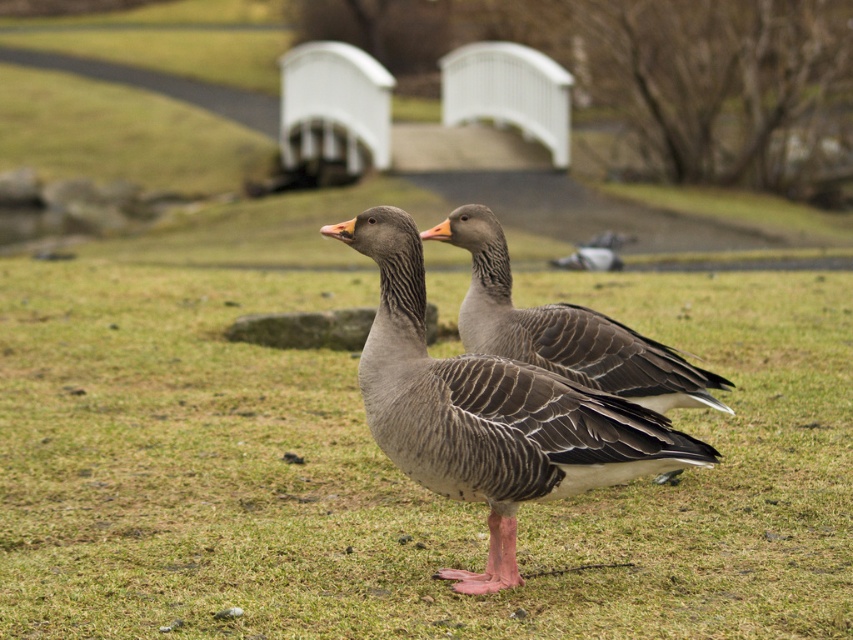
Question: Considering the real-world distances, which object is farthest from the gray matte pigeon at center?

Choices:
 (A) gray matte goose at center
 (B) gray matte duck at center

Answer: (B)

Question: Does gray matte duck at center have a larger size compared to gray matte goose at center?

Choices:
 (A) no
 (B) yes

Answer: (B)

Question: Observing the image, what is the correct spatial positioning of gray matte goose at center in reference to gray matte pigeon at center?

Choices:
 (A) left
 (B) right

Answer: (A)

Question: Is gray matte duck at center to the right of gray matte pigeon at center from the viewer's perspective?

Choices:
 (A) yes
 (B) no

Answer: (B)

Question: Which object is closer to the camera taking this photo?

Choices:
 (A) gray matte pigeon at center
 (B) gray matte duck at center
 (C) gray matte goose at center

Answer: (B)

Question: Based on their relative distances, which object is nearer to the gray matte pigeon at center?

Choices:
 (A) gray matte goose at center
 (B) gray matte duck at center

Answer: (A)